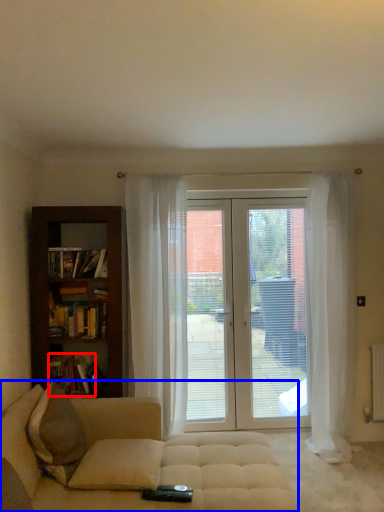
Question: Which object appears closest to the camera in this image, book (highlighted by a red box) or studio couch (highlighted by a blue box)?

Choices:
 (A) book
 (B) studio couch

Answer: (B)